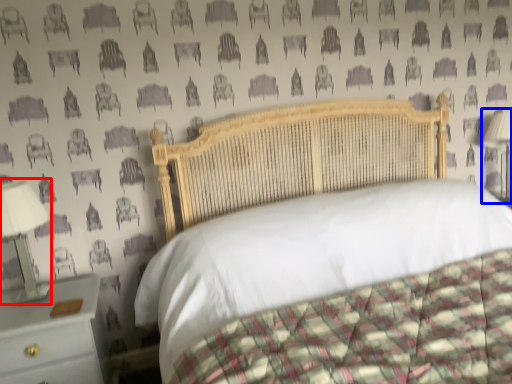
Question: Which object is closer to the camera taking this photo, bedside lamp (highlighted by a red box) or bedside lamp (highlighted by a blue box)?

Choices:
 (A) bedside lamp
 (B) bedside lamp

Answer: (A)